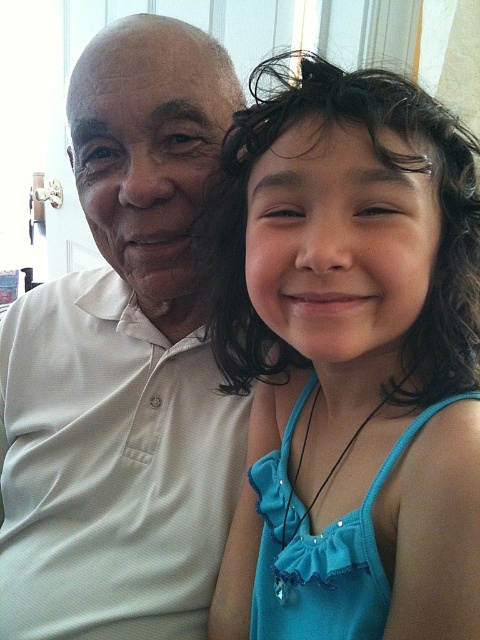
From the picture: You are a tailor who needs to determine which garment has a narrower width for a customer. You see the blue satin dress at right and the white matte shirt at left in the image. Which one is narrower?

The blue satin dress at right is narrower than the white matte shirt at left because its width is less than the shirt.

You are organizing a photoshoot and need to arrange the blue satin dress at right and the white matte shirt at left in a display case. Based on their positions in the image, which item should you place on the right side of the display case?

The blue satin dress at right should be placed on the right side of the display case because it is already positioned on the right side of the white matte shirt at left in the image.